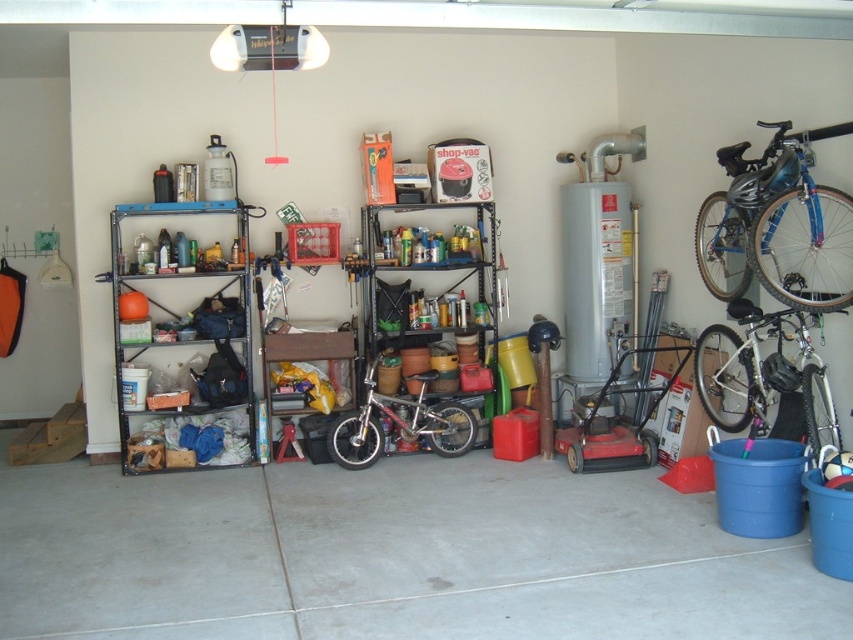
Based on the photo, you are organizing the garage and need to place a large box that requires a flat surface. Which object between the metallic silver shelves at center and the wooden workbench at center can accommodate the box based on their sizes?

The metallic silver shelves at center has a larger size compared to wooden workbench at center, so the large box should be placed on the metallic silver shelves at center.

You are trying to move the shiny silver bicycle at right closer to the wooden workbench at center. Which direction should you push it to make it closer?

You should push the shiny silver bicycle at right to the left to make it closer to the wooden workbench at center because it is currently to the right of it.

You are trying to move the shiny silver bicycle at right through a narrow doorway that is only wide enough for items thinner than the wooden workbench at center. Can the bicycle fit through the doorway?

The shiny silver bicycle at right is thinner than the wooden workbench at center, so it can fit through the doorway.